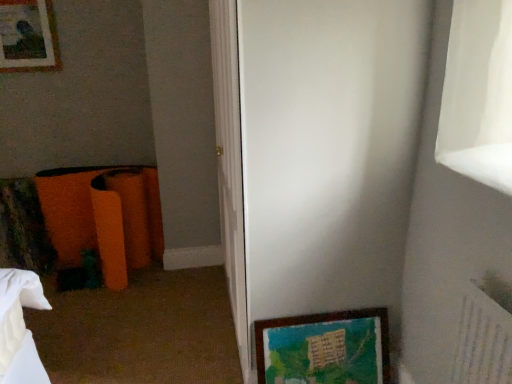
You are a GUI agent. You are given a task and a screenshot of the screen. Output one action in this format:
    pyautogui.click(x=<x>, y=<y>)
    Task: Click on the vacant space that is to the left of white glossy screen door at center
    Image resolution: width=512 pixels, height=384 pixels.
    Given the screenshot: What is the action you would take?
    [152, 322]